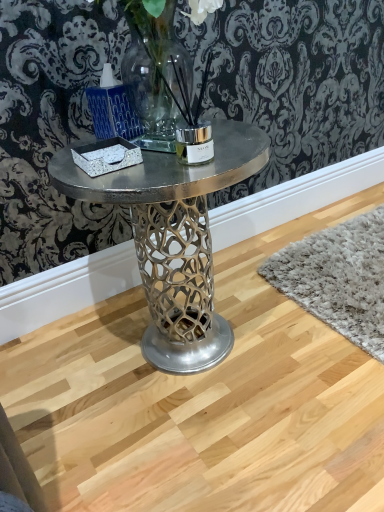
At what (x,y) coordinates should I click in order to perform the action: click on vacant space situated above metallic silver table at center (from a real-world perspective). Please return your answer as a coordinate pair (x, y). This screenshot has height=512, width=384. Looking at the image, I should click on (275, 187).